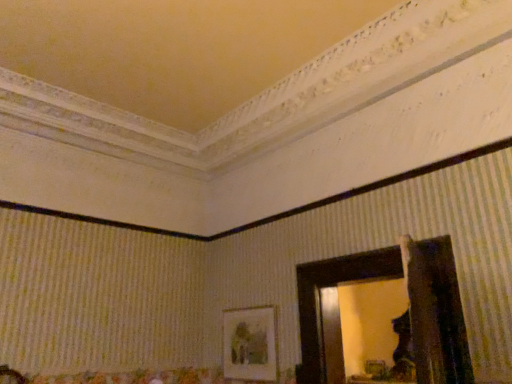
Where is `matte white picture frame at lower center`? The height and width of the screenshot is (384, 512). matte white picture frame at lower center is located at coordinates (250, 344).

What do you see at coordinates (250, 344) in the screenshot?
I see `matte white picture frame at lower center` at bounding box center [250, 344].

Identify the location of matte white picture frame at lower center. (250, 344).